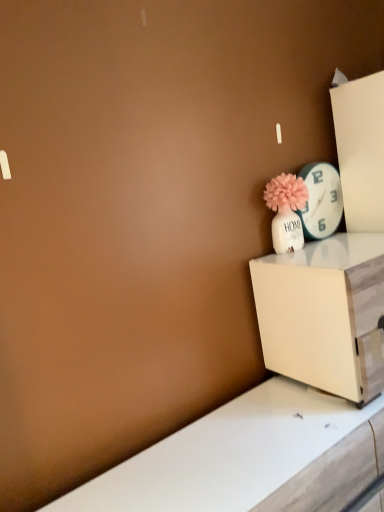
Describe the element at coordinates (321, 200) in the screenshot. I see `white glossy clock at upper right` at that location.

What is the approximate width of white wood nightstand at lower right?

white wood nightstand at lower right is 17.57 inches in width.

You are a GUI agent. You are given a task and a screenshot of the screen. Output one action in this format:
    pyautogui.click(x=<x>, y=<y>)
    Task: Click on the white wood nightstand at lower right
    
    Given the screenshot: What is the action you would take?
    pyautogui.click(x=325, y=314)

This screenshot has height=512, width=384. What are the coordinates of `matte white vase with pink flower at upper right` in the screenshot? It's located at (x=286, y=211).

Does white glossy clock at upper right have a lesser width compared to white wood nightstand at lower right?

Indeed, white glossy clock at upper right has a lesser width compared to white wood nightstand at lower right.

Considering the relative sizes of white glossy clock at upper right and white wood nightstand at lower right in the image provided, is white glossy clock at upper right smaller than white wood nightstand at lower right?

Yes, white glossy clock at upper right is smaller than white wood nightstand at lower right.

Is white glossy clock at upper right facing away from white wood nightstand at lower right?

No, white wood nightstand at lower right is not at the back of white glossy clock at upper right.

Is point (330, 225) less distant than point (299, 228)?

That is False.

Is white glossy clock at upper right positioned with its back to matte white vase with pink flower at upper right?

No.

From the image's perspective, who appears lower, white glossy clock at upper right or matte white vase with pink flower at upper right?

matte white vase with pink flower at upper right is shown below in the image.

Between white glossy clock at upper right and matte white vase with pink flower at upper right, which one appears on the left side from the viewer's perspective?

Positioned to the left is matte white vase with pink flower at upper right.

From a real-world perspective, does white wood nightstand at lower right stand above matte white vase with pink flower at upper right?

No, from a real-world perspective, white wood nightstand at lower right is not on top of matte white vase with pink flower at upper right.

Could matte white vase with pink flower at upper right be considered to be inside white wood nightstand at lower right?

No, matte white vase with pink flower at upper right is located outside of white wood nightstand at lower right.

From the image's perspective, is white wood nightstand at lower right located beneath matte white vase with pink flower at upper right?

Yes, from the image's perspective, white wood nightstand at lower right is below matte white vase with pink flower at upper right.

You are a GUI agent. You are given a task and a screenshot of the screen. Output one action in this format:
    pyautogui.click(x=<x>, y=<y>)
    Task: Click on the floral arrangement above the white wood nightstand at lower right (from the image's perspective)
    
    Given the screenshot: What is the action you would take?
    pyautogui.click(x=286, y=211)

Is white wood nightstand at lower right facing away from white glossy clock at upper right?

No, white wood nightstand at lower right's orientation is not away from white glossy clock at upper right.

Is white glossy clock at upper right a part of white wood nightstand at lower right?

Actually, white glossy clock at upper right is outside white wood nightstand at lower right.

Are white wood nightstand at lower right and white glossy clock at upper right far apart?

No, white wood nightstand at lower right is in close proximity to white glossy clock at upper right.

Does white wood nightstand at lower right have a lesser height compared to white glossy clock at upper right?

Incorrect, the height of white wood nightstand at lower right does not fall short of that of white glossy clock at upper right.

Who is smaller, matte white vase with pink flower at upper right or white glossy clock at upper right?

Smaller between the two is white glossy clock at upper right.

Considering the relative sizes of matte white vase with pink flower at upper right and white glossy clock at upper right in the image provided, is matte white vase with pink flower at upper right taller than white glossy clock at upper right?

No, matte white vase with pink flower at upper right is not taller than white glossy clock at upper right.

From a real-world perspective, is matte white vase with pink flower at upper right physically above white glossy clock at upper right?

Actually, matte white vase with pink flower at upper right is physically below white glossy clock at upper right in the real world.

Is white glossy clock at upper right at the back of matte white vase with pink flower at upper right?

No, white glossy clock at upper right is not at the back of matte white vase with pink flower at upper right.

From the image's perspective, is matte white vase with pink flower at upper right located above white wood nightstand at lower right?

Correct, matte white vase with pink flower at upper right appears higher than white wood nightstand at lower right in the image.

Between matte white vase with pink flower at upper right and white wood nightstand at lower right, which one has less height?

With less height is matte white vase with pink flower at upper right.

Looking at this image, considering the sizes of matte white vase with pink flower at upper right and white wood nightstand at lower right in the image, is matte white vase with pink flower at upper right wider or thinner than white wood nightstand at lower right?

Clearly, matte white vase with pink flower at upper right has less width compared to white wood nightstand at lower right.

Identify the location of floral arrangement above the white wood nightstand at lower right (from the image's perspective). (286, 211).

You are a GUI agent. You are given a task and a screenshot of the screen. Output one action in this format:
    pyautogui.click(x=<x>, y=<y>)
    Task: Click on the clock that appears above the white wood nightstand at lower right (from a real-world perspective)
    The height and width of the screenshot is (512, 384).
    Given the screenshot: What is the action you would take?
    pyautogui.click(x=321, y=200)

Where is `clock above the matte white vase with pink flower at upper right (from the image's perspective)`? clock above the matte white vase with pink flower at upper right (from the image's perspective) is located at coordinates (321, 200).

Looking at the image, which one is located further to matte white vase with pink flower at upper right, white wood nightstand at lower right or white glossy clock at upper right?

Among the two, white wood nightstand at lower right is located further to matte white vase with pink flower at upper right.

Considering their positions, is matte white vase with pink flower at upper right positioned further to white glossy clock at upper right than white wood nightstand at lower right?

The object further to white glossy clock at upper right is white wood nightstand at lower right.

Considering their positions, is white wood nightstand at lower right positioned closer to white glossy clock at upper right than matte white vase with pink flower at upper right?

matte white vase with pink flower at upper right is closer to white glossy clock at upper right.

Looking at the image, which one is located further to white wood nightstand at lower right, matte white vase with pink flower at upper right or white glossy clock at upper right?

white glossy clock at upper right lies further to white wood nightstand at lower right than the other object.

From the image, which object appears to be nearer to matte white vase with pink flower at upper right, white glossy clock at upper right or white wood nightstand at lower right?

Among the two, white glossy clock at upper right is located nearer to matte white vase with pink flower at upper right.

In the scene shown: Based on their spatial positions, is white glossy clock at upper right or matte white vase with pink flower at upper right further from white wood nightstand at lower right?

white glossy clock at upper right is further to white wood nightstand at lower right.

At what (x,y) coordinates should I click in order to perform the action: click on floral arrangement between white glossy clock at upper right and white wood nightstand at lower right vertically. Please return your answer as a coordinate pair (x, y). This screenshot has height=512, width=384. Looking at the image, I should click on (286, 211).